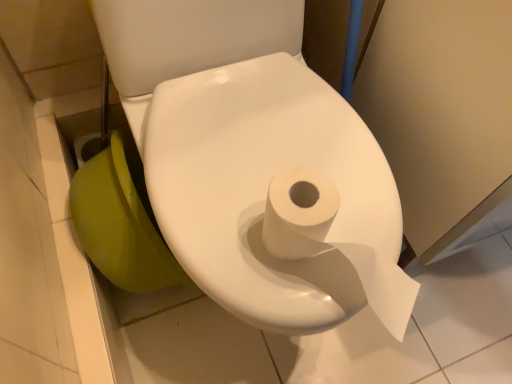
Question: From the image's perspective, would you say green glossy toilet bowl at lower left is shown under white matte toilet paper at center?

Choices:
 (A) no
 (B) yes

Answer: (B)

Question: From the image's perspective, is green glossy toilet bowl at lower left located above white matte toilet paper at center?

Choices:
 (A) no
 (B) yes

Answer: (A)

Question: Is the depth of green glossy toilet bowl at lower left greater than that of white matte toilet paper at center?

Choices:
 (A) yes
 (B) no

Answer: (A)

Question: Does green glossy toilet bowl at lower left have a greater height compared to white matte toilet paper at center?

Choices:
 (A) no
 (B) yes

Answer: (A)

Question: Considering the relative positions of green glossy toilet bowl at lower left and white matte toilet paper at center in the image provided, is green glossy toilet bowl at lower left in front of white matte toilet paper at center?

Choices:
 (A) yes
 (B) no

Answer: (B)

Question: Is green glossy toilet bowl at lower left at the right side of white matte toilet paper at center?

Choices:
 (A) yes
 (B) no

Answer: (B)

Question: Is the position of white matte toilet paper at center more distant than that of green glossy toilet bowl at lower left?

Choices:
 (A) yes
 (B) no

Answer: (B)

Question: Is white matte toilet paper at center smaller than green glossy toilet bowl at lower left?

Choices:
 (A) yes
 (B) no

Answer: (B)

Question: Considering the relative sizes of white matte toilet paper at center and green glossy toilet bowl at lower left in the image provided, is white matte toilet paper at center thinner than green glossy toilet bowl at lower left?

Choices:
 (A) no
 (B) yes

Answer: (A)

Question: Does white matte toilet paper at center have a greater height compared to green glossy toilet bowl at lower left?

Choices:
 (A) yes
 (B) no

Answer: (A)

Question: Can you confirm if white matte toilet paper at center is bigger than green glossy toilet bowl at lower left?

Choices:
 (A) yes
 (B) no

Answer: (A)

Question: Does white matte toilet paper at center turn towards green glossy toilet bowl at lower left?

Choices:
 (A) no
 (B) yes

Answer: (A)

Question: Is point (126, 208) closer or farther from the camera than point (240, 64)?

Choices:
 (A) closer
 (B) farther

Answer: (A)